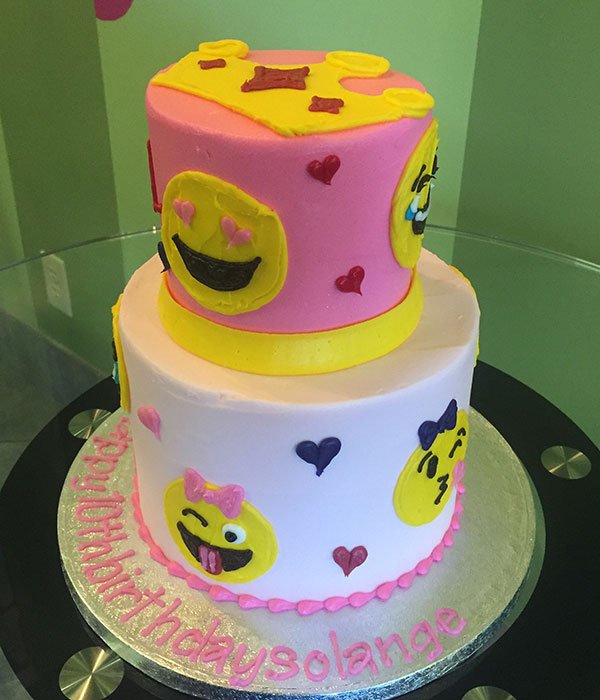
I want to click on silver detailing on table, so click(x=81, y=421), click(x=91, y=675), click(x=485, y=696), click(x=569, y=463).